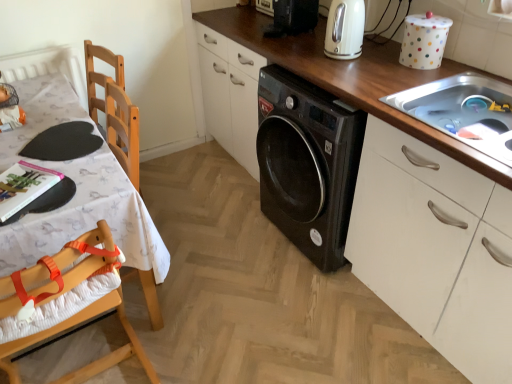
Describe the element at coordinates (79, 194) in the screenshot. I see `wooden table at left` at that location.

How much space does black plastic washing machine at upper center, which ranks as the 2th appliance in front-to-back order, occupy horizontally?

black plastic washing machine at upper center, which ranks as the 2th appliance in front-to-back order, is 14.06 inches in width.

This screenshot has width=512, height=384. What are the coordinates of `black plastic washing machine at upper center, which is the 1th appliance from top to bottom` in the screenshot? It's located at (292, 17).

Describe the element at coordinates (424, 41) in the screenshot. I see `white polka dot container at upper right, the second appliance viewed from the top` at that location.

You are a GUI agent. You are given a task and a screenshot of the screen. Output one action in this format:
    pyautogui.click(x=<x>, y=<y>)
    Task: Click on the wooden at center
    Image resolution: width=512 pixels, height=384 pixels.
    Given the screenshot: What is the action you would take?
    pyautogui.click(x=411, y=201)

Where is `wooden table at left`? The width and height of the screenshot is (512, 384). wooden table at left is located at coordinates (79, 194).

Between wooden table at left and wooden highchair at left, which one has smaller size?

wooden table at left.

Find the location of a particular element. chair that appears on the right of wooden table at left is located at coordinates (60, 270).

From the image's perspective, who appears lower, wooden table at left or wooden highchair at left?

From the image's view, wooden highchair at left is below.

From the picture: Is wooden table at left far from wooden highchair at left?

They are positioned close to each other.

From a real-world perspective, is black plastic washing machine at upper center, which ranks as the 2th appliance in front-to-back order, positioned over wooden at center based on gravity?

Correct, in the physical world, black plastic washing machine at upper center, which ranks as the 2th appliance in front-to-back order, is higher than wooden at center.

In the scene shown: Between black plastic washing machine at upper center, positioned as the 1th appliance in back-to-front order, and wooden at center, which one is positioned in front?

wooden at center is in front.

Is point (296, 17) closer or farther from the camera than point (335, 61)?

Point (296, 17) appears to be farther away from the viewer than point (335, 61).

Is white glossy electric kettle at upper center facing away from wooden table at left?

No, white glossy electric kettle at upper center is not facing away from wooden table at left.

From the image's perspective, between white glossy electric kettle at upper center and wooden table at left, who is located below?

wooden table at left is shown below in the image.

At what (x,y) coordinates should I click in order to perform the action: click on home appliance above the wooden table at left (from the image's perspective). Please return your answer as a coordinate pair (x, y). Looking at the image, I should click on (345, 29).

Is wooden table at left located within white glossy electric kettle at upper center?

No, wooden table at left is not a part of white glossy electric kettle at upper center.

From a real-world perspective, is white glossy electric kettle at upper center physically located above or below stainless steel sink at upper right?

white glossy electric kettle at upper center is above stainless steel sink at upper right.

Is white glossy electric kettle at upper center surrounding stainless steel sink at upper right?

No, stainless steel sink at upper right is not surrounded by white glossy electric kettle at upper center.

Is white glossy electric kettle at upper center facing away from stainless steel sink at upper right?

No, white glossy electric kettle at upper center's orientation is not away from stainless steel sink at upper right.

Is point (355, 6) closer or farther from the camera than point (442, 104)?

Point (355, 6) appears to be farther away from the viewer than point (442, 104).

Considering the sizes of objects wooden at center and wooden highchair at left in the image provided, who is wider, wooden at center or wooden highchair at left?

Wider between the two is wooden at center.

From the picture: Considering the positions of objects wooden at center and wooden highchair at left in the image provided, who is more to the right, wooden at center or wooden highchair at left?

Positioned to the right is wooden at center.

Image resolution: width=512 pixels, height=384 pixels. Identify the location of countertop positioned vertically above the wooden highchair at left (from a real-world perspective). (411, 201).

Is wooden at center oriented away from wooden highchair at left?

No, wooden at center is not facing the opposite direction of wooden highchair at left.

Between wooden at center and black plastic washing machine at upper center, which ranks as the 2th appliance in front-to-back order, which one has smaller size?

With smaller size is black plastic washing machine at upper center, which ranks as the 2th appliance in front-to-back order.

Between wooden at center and black plastic washing machine at upper center, which ranks as the 2th appliance in front-to-back order, which one is positioned behind?

black plastic washing machine at upper center, which ranks as the 2th appliance in front-to-back order, is behind.

From the image's perspective, is wooden at center positioned above or below black plastic washing machine at upper center, which ranks as the 2th appliance in front-to-back order?

wooden at center is below black plastic washing machine at upper center, which ranks as the 2th appliance in front-to-back order.

Which is closer to the camera, (468,246) or (294,6)?

The point (468,246) is more forward.

Is wooden at center bigger than white glossy electric kettle at upper center?

Yes, wooden at center is bigger than white glossy electric kettle at upper center.

Is wooden at center to the left of white glossy electric kettle at upper center from the viewer's perspective?

Incorrect, wooden at center is not on the left side of white glossy electric kettle at upper center.

Does point (396, 74) come farther from viewer compared to point (328, 56)?

No, (396, 74) is in front of (328, 56).

Image resolution: width=512 pixels, height=384 pixels. In order to click on chair that appears below the wooden table at left (from the image's perspective) in this screenshot , I will do pos(60,270).

Locate an element on the screen. the 1st appliance positioned above the wooden at center (from a real-world perspective) is located at coordinates (292, 17).

Considering their positions, is white glossy electric kettle at upper center positioned further to black plastic washing machine at upper center, the second appliance when ordered from bottom to top, than wooden at center?

wooden at center.

Considering their positions, is white polka dot container at upper right, the 1th appliance in the front-to-back sequence, positioned closer to wooden highchair at left than wooden at center?

wooden at center is closer to wooden highchair at left.

Looking at the image, which one is located closer to wooden at center, wooden table at left or white glossy electric kettle at upper center?

white glossy electric kettle at upper center is closer to wooden at center.

Based on their spatial positions, is wooden highchair at left or white polka dot container at upper right, the 2th appliance in the back-to-front sequence, closer to wooden at center?

white polka dot container at upper right, the 2th appliance in the back-to-front sequence, is positioned closer to the anchor wooden at center.

Based on the photo, from the image, which object appears to be nearer to white glossy electric kettle at upper center, black plastic washing machine at upper center, the second appliance when ordered from bottom to top, or wooden table at left?

Based on the image, black plastic washing machine at upper center, the second appliance when ordered from bottom to top, appears to be nearer to white glossy electric kettle at upper center.

Which object lies further to the anchor point wooden at center, stainless steel sink at upper right or wooden highchair at left?

wooden highchair at left lies further to wooden at center than the other object.

Considering their positions, is white polka dot container at upper right, arranged as the second appliance when viewed from the left, positioned closer to wooden at center than stainless steel sink at upper right?

Based on the image, stainless steel sink at upper right appears to be nearer to wooden at center.

Looking at the image, which one is located further to black plastic washing machine at upper center, which is counted as the first appliance, starting from the left, wooden at center or white polka dot container at upper right, arranged as the second appliance when viewed from the left?

wooden at center.

Where is `chair located between wooden table at left and wooden at center in the left-right direction`? This screenshot has width=512, height=384. chair located between wooden table at left and wooden at center in the left-right direction is located at coordinates (60, 270).

Identify the location of sink between wooden at center and white polka dot container at upper right, the 1th appliance in the front-to-back sequence, from front to back. (464, 111).

What are the coordinates of `appliance between wooden table at left and white polka dot container at upper right, arranged as the second appliance when viewed from the left, in the horizontal direction` in the screenshot? It's located at (292, 17).

The height and width of the screenshot is (384, 512). I want to click on appliance between wooden at center and white glossy electric kettle at upper center along the z-axis, so [x=424, y=41].